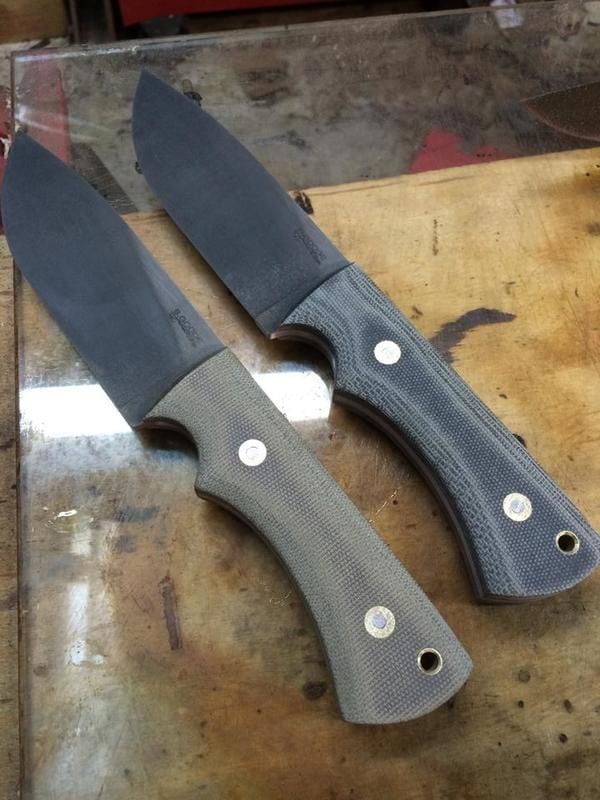
Where is `towel`? Image resolution: width=600 pixels, height=800 pixels. towel is located at coordinates (441, 162).